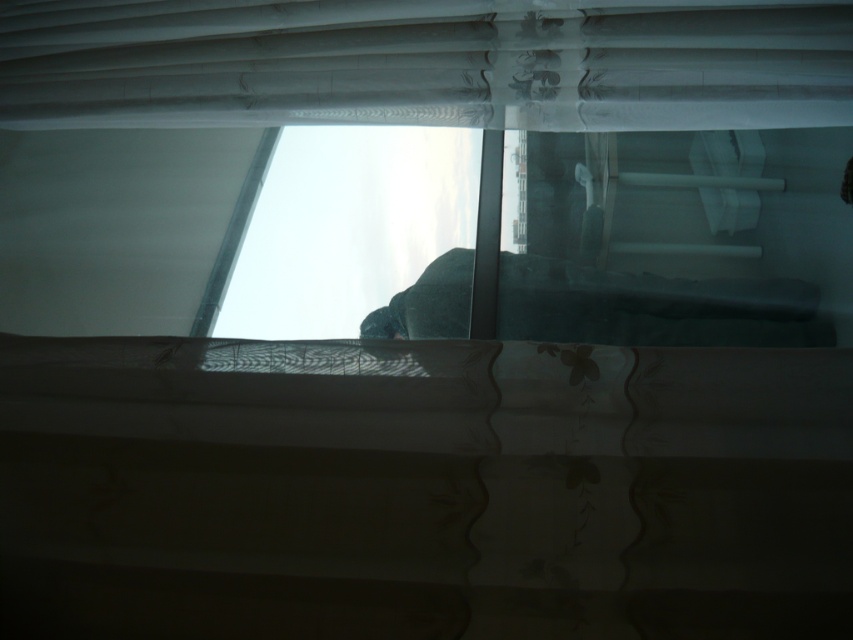
You are standing in a room and want to look outside through the transparent glass window at center. Where should you look to see the outside view?

You should look at the transparent glass window at center, which is located at the 2D coordinates point [677,237] to see the outside view.

You are trying to hang a decorative banner that is 1.2 meters wide on the transparent glass window at center and the sheer white curtain at upper center. Based on their widths, which object can the banner fit on without overlapping the edges?

The sheer white curtain at upper center has a greater width than the transparent glass window at center. Since the banner is 1.2 meters wide, it can fit on the sheer white curtain at upper center as it is wider.

You are trying to see outside through the window. Which object is blocking your view more, the transparent glass window at center or the sheer white curtain at upper center?

The sheer white curtain at upper center is blocking your view more because it is positioned to the left of the transparent glass window at center, which is on the right side of it.